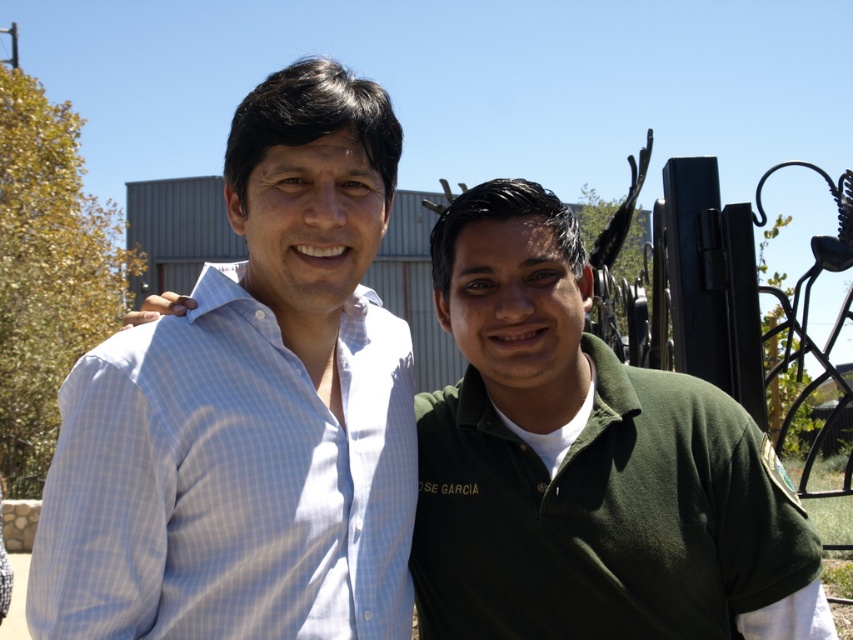
Based on the photo, does light blue checkered shirt at center have a lesser width compared to green cotton polo shirt at center?

Yes, light blue checkered shirt at center is thinner than green cotton polo shirt at center.

How far apart are light blue checkered shirt at center and green cotton polo shirt at center?

light blue checkered shirt at center is 30.77 inches from green cotton polo shirt at center.

Where is `light blue checkered shirt at center`? Image resolution: width=853 pixels, height=640 pixels. light blue checkered shirt at center is located at coordinates (230, 481).